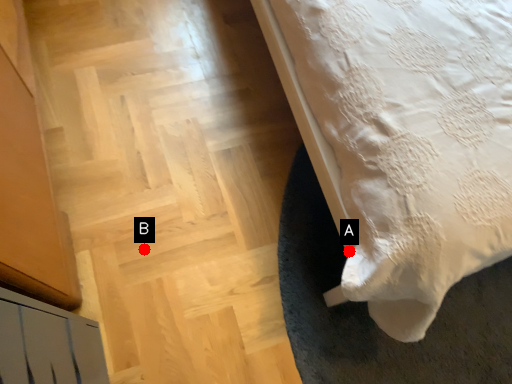
Question: Two points are circled on the image, labeled by A and B beside each circle. Which of the following is the farthest from the observer?

Choices:
 (A) A is further
 (B) B is further

Answer: (B)